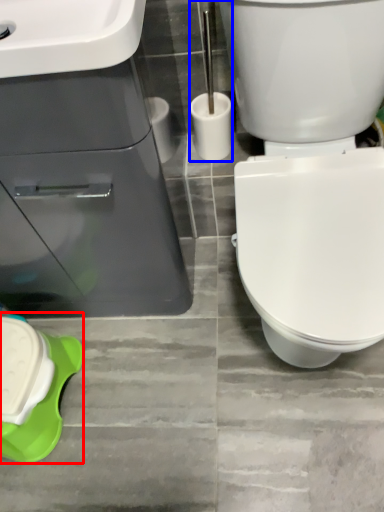
Question: Which object appears closest to the camera in this image, porcelain (highlighted by a red box) or brush (highlighted by a blue box)?

Choices:
 (A) porcelain
 (B) brush

Answer: (B)